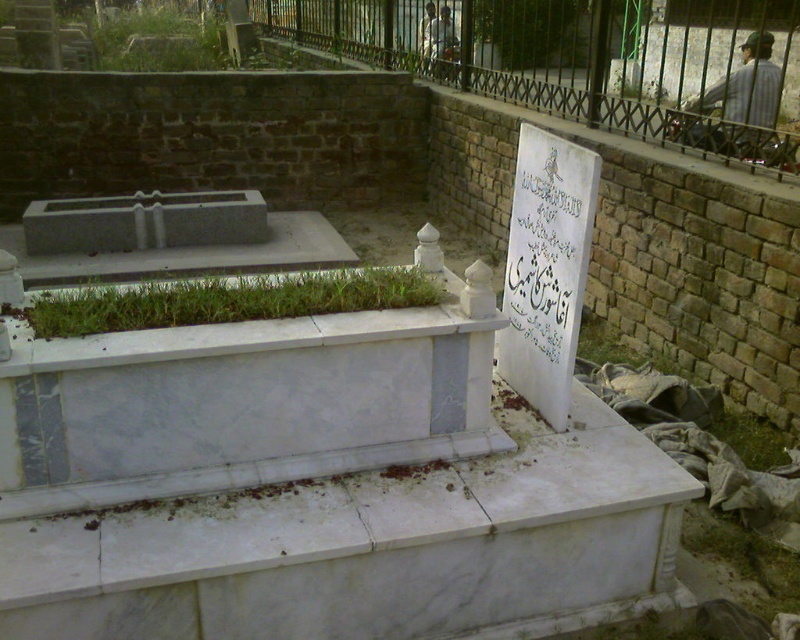
Between black wrought iron fence at upper right and green grass at center, which one appears on the left side from the viewer's perspective?

green grass at center is more to the left.

Which of these two, black wrought iron fence at upper right or green grass at center, stands shorter?

Standing shorter between the two is green grass at center.

Between point (297, 35) and point (208, 323), which one is positioned behind?

The point (297, 35) is behind.

This screenshot has height=640, width=800. Identify the location of black wrought iron fence at upper right. (586, 60).

Is green grass at center above striped shirt at upper right?

Actually, green grass at center is below striped shirt at upper right.

Who is more forward, (50, 316) or (736, 106)?

Positioned in front is point (50, 316).

This screenshot has height=640, width=800. I want to click on green grass at center, so point(226,300).

Is black wrought iron fence at upper right shorter than striped shirt at upper right?

Incorrect, black wrought iron fence at upper right's height does not fall short of striped shirt at upper right's.

Is point (696, 26) more distant than point (740, 112)?

Yes.

Who is more forward, (504, 96) or (770, 83)?

Point (504, 96) is more forward.

Find the location of a particular element. The height and width of the screenshot is (640, 800). black wrought iron fence at upper right is located at coordinates (586, 60).